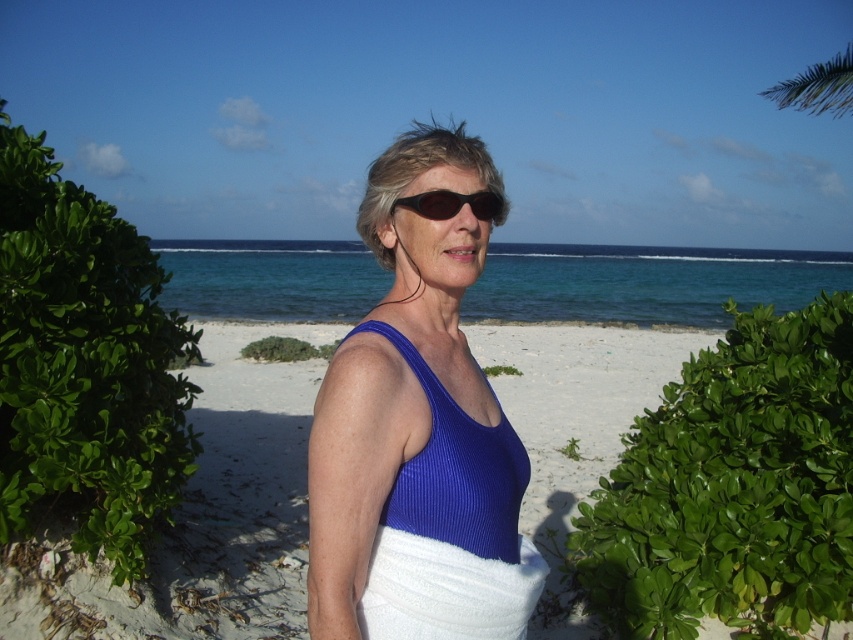
Can you confirm if white sand at center is positioned to the left of white terry cloth towel at lower center?

Indeed, white sand at center is positioned on the left side of white terry cloth towel at lower center.

The width and height of the screenshot is (853, 640). Describe the element at coordinates (202, 516) in the screenshot. I see `white sand at center` at that location.

Locate an element on the screen. The width and height of the screenshot is (853, 640). white sand at center is located at coordinates (x=202, y=516).

I want to click on blue ribbed tank top at center, so click(x=413, y=404).

Who is more forward, (398,321) or (392,570)?

Point (392,570) is in front.

At what (x,y) coordinates should I click in order to perform the action: click on blue ribbed tank top at center. Please return your answer as a coordinate pair (x, y). Looking at the image, I should click on (413, 404).

Looking at this image, between white terry cloth towel at lower center and black plastic sunglasses at center, which one has more height?

With more height is white terry cloth towel at lower center.

Does point (451, 627) lie behind point (486, 202)?

That is False.

The image size is (853, 640). In order to click on white terry cloth towel at lower center in this screenshot , I will do `click(445, 589)`.